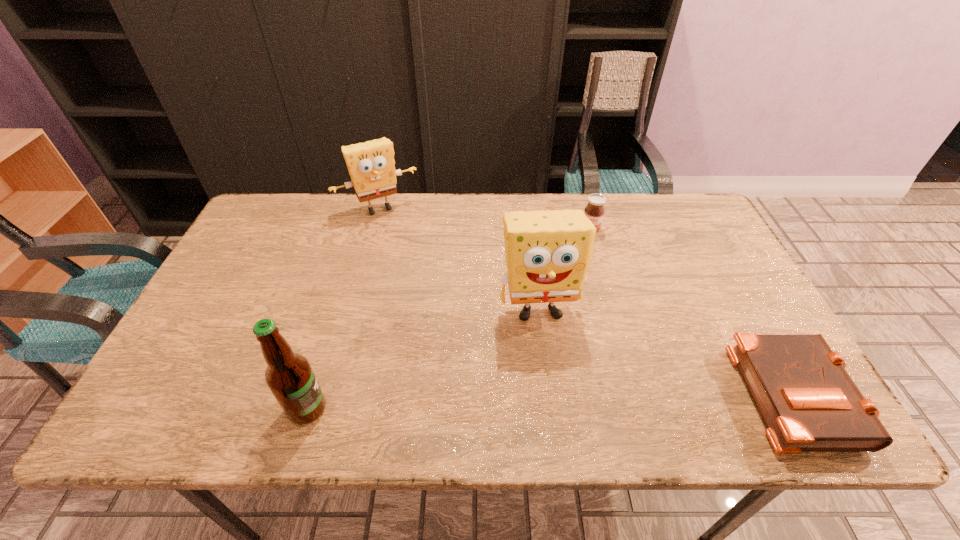
Where is `blank area located 0.110m on the face of the third nearest object`? This screenshot has height=540, width=960. blank area located 0.110m on the face of the third nearest object is located at coordinates (554, 373).

Find the location of a particular element. vacant space situated on the face of the third nearest object is located at coordinates (549, 352).

The image size is (960, 540). Find the location of `vacant space located on the face of the farther sponge`. vacant space located on the face of the farther sponge is located at coordinates (403, 237).

Where is `vacant space located 0.320m on the face of the farther sponge`? The image size is (960, 540). vacant space located 0.320m on the face of the farther sponge is located at coordinates (430, 285).

I want to click on vacant space located on the face of the farther sponge, so click(x=429, y=283).

The height and width of the screenshot is (540, 960). In order to click on vacant space situated on the label side of the fourth nearest object in this screenshot , I will do pyautogui.click(x=592, y=291).

I want to click on free region located on the label side of the fourth nearest object, so click(x=592, y=291).

This screenshot has width=960, height=540. I want to click on free space located on the label side of the fourth nearest object, so click(592, 296).

Locate an element on the screen. This screenshot has height=540, width=960. sponge located in the far edge section of the desktop is located at coordinates (371, 167).

Locate an element on the screen. This screenshot has height=540, width=960. jam located in the far edge section of the desktop is located at coordinates (594, 210).